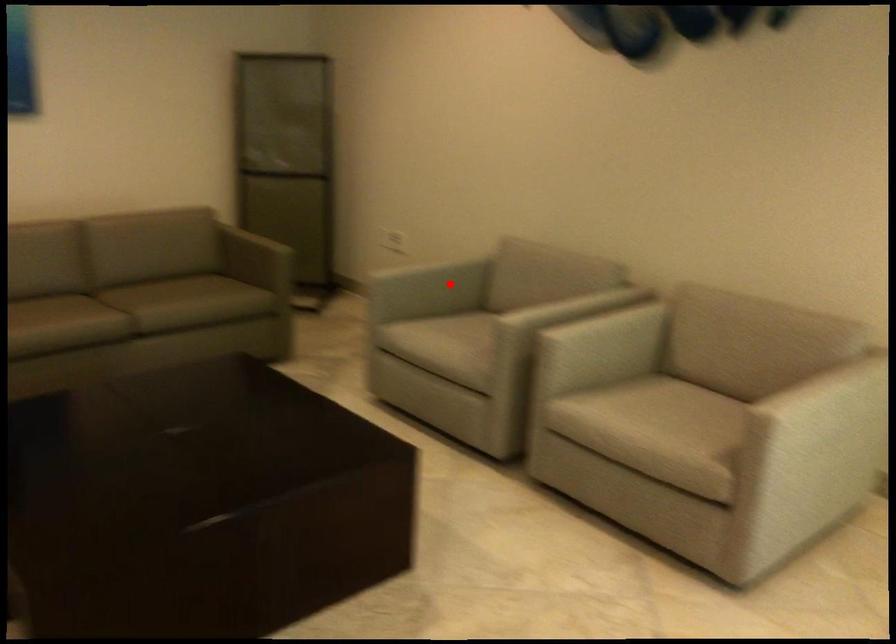
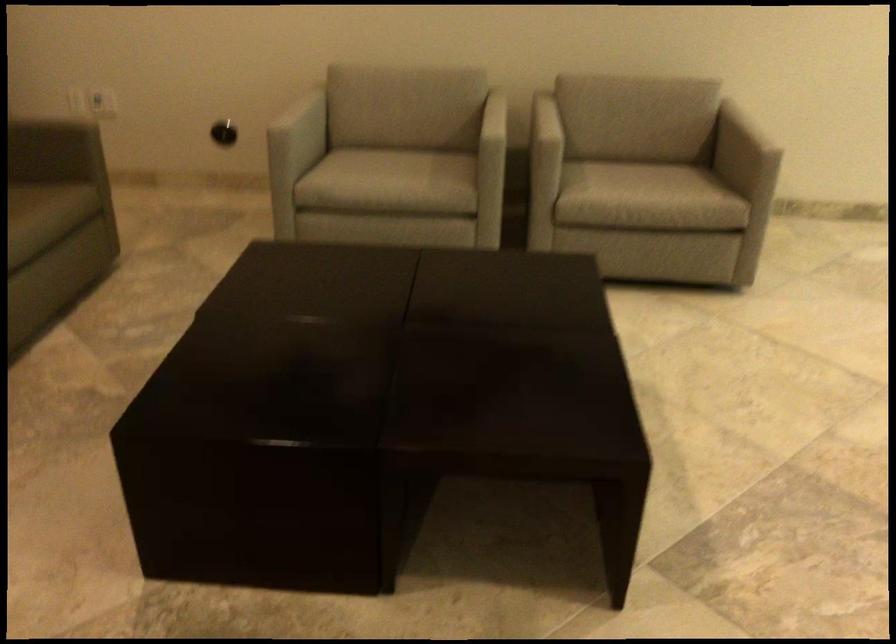
In the second image, find the point that corresponds to the highlighted location in the first image.

(304, 124)